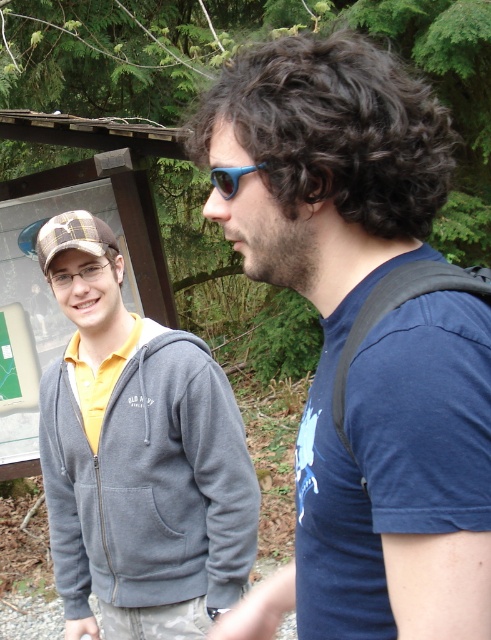
Can you confirm if blue matte t-shirt at center is wider than matte gray hoodie at left?

In fact, blue matte t-shirt at center might be narrower than matte gray hoodie at left.

Can you confirm if blue matte t-shirt at center is thinner than matte gray hoodie at left?

Yes, blue matte t-shirt at center is thinner than matte gray hoodie at left.

Image resolution: width=491 pixels, height=640 pixels. Describe the element at coordinates (361, 340) in the screenshot. I see `blue matte t-shirt at center` at that location.

The height and width of the screenshot is (640, 491). I want to click on blue matte t-shirt at center, so click(361, 340).

Between point (71, 547) and point (226, 179), which one is positioned in front?

Positioned in front is point (226, 179).

Is point (75, 449) farther from viewer compared to point (232, 195)?

Yes.

Where is `matte gray hoodie at left`? Image resolution: width=491 pixels, height=640 pixels. matte gray hoodie at left is located at coordinates (137, 456).

Does plaid fabric baseball cap at left lie in front of blue rubber sunglasses at center?

No, it is behind blue rubber sunglasses at center.

Which is above, plaid fabric baseball cap at left or blue rubber sunglasses at center?

plaid fabric baseball cap at left is above.

Find the location of a particular element. This screenshot has height=640, width=491. plaid fabric baseball cap at left is located at coordinates click(x=74, y=236).

The image size is (491, 640). Find the location of `plaid fabric baseball cap at left`. plaid fabric baseball cap at left is located at coordinates (74, 236).